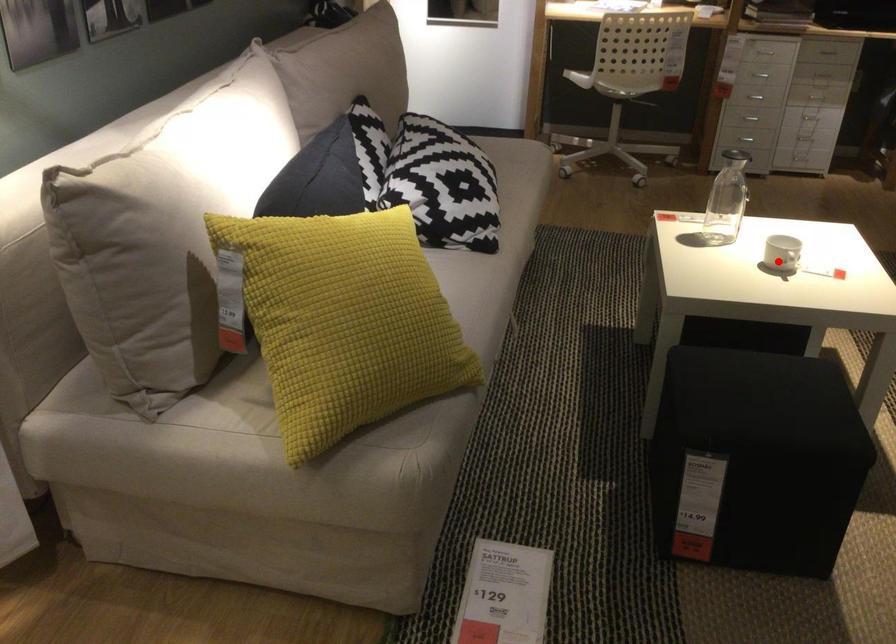
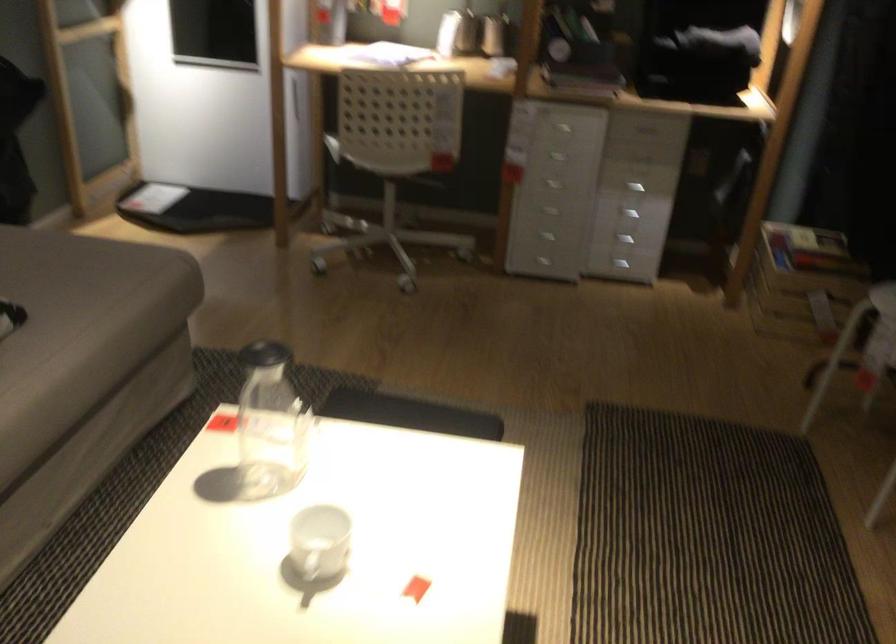
Where in the second image is the point corresponding to the highlighted location from the first image?

(320, 542)